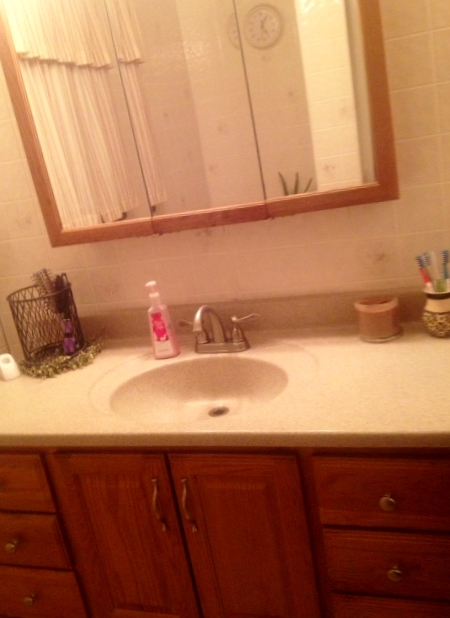
Where is `sink basin`? sink basin is located at coordinates (185, 399).